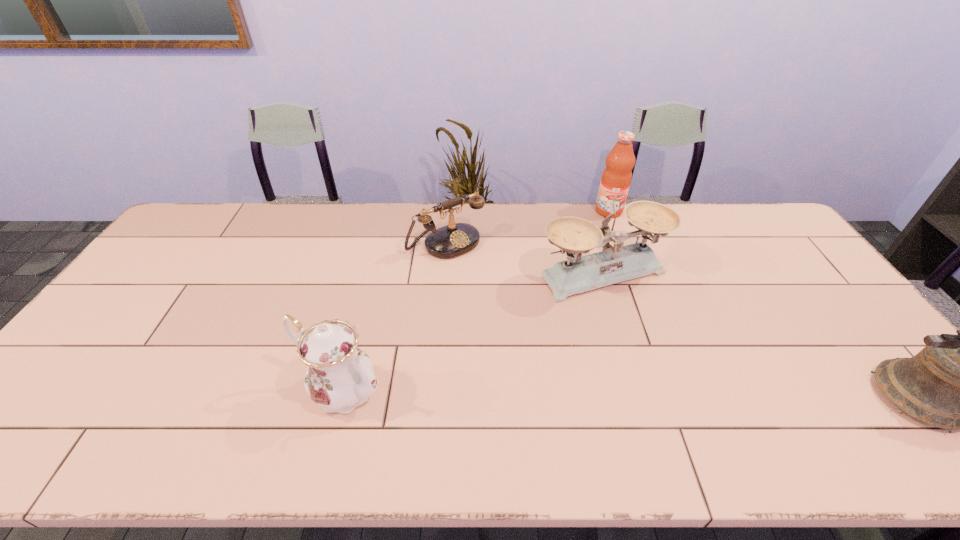
Locate an element on the screen. This screenshot has height=540, width=960. vacant space on the desktop that is between the chinaware and the rightmost object and is positioned on the dial of the telephone is located at coordinates (592, 393).

This screenshot has width=960, height=540. I want to click on free space on the desktop that is between the chinaware and the rightmost object and is positioned on the front-facing side of the scale, so click(x=702, y=395).

You are a GUI agent. You are given a task and a screenshot of the screen. Output one action in this format:
    pyautogui.click(x=<x>, y=<y>)
    Task: Click on the vacant space on the desktop that is between the chinaware and the bell and is positioned on the front label of the fruit juice
    The width and height of the screenshot is (960, 540).
    Given the screenshot: What is the action you would take?
    pyautogui.click(x=586, y=393)